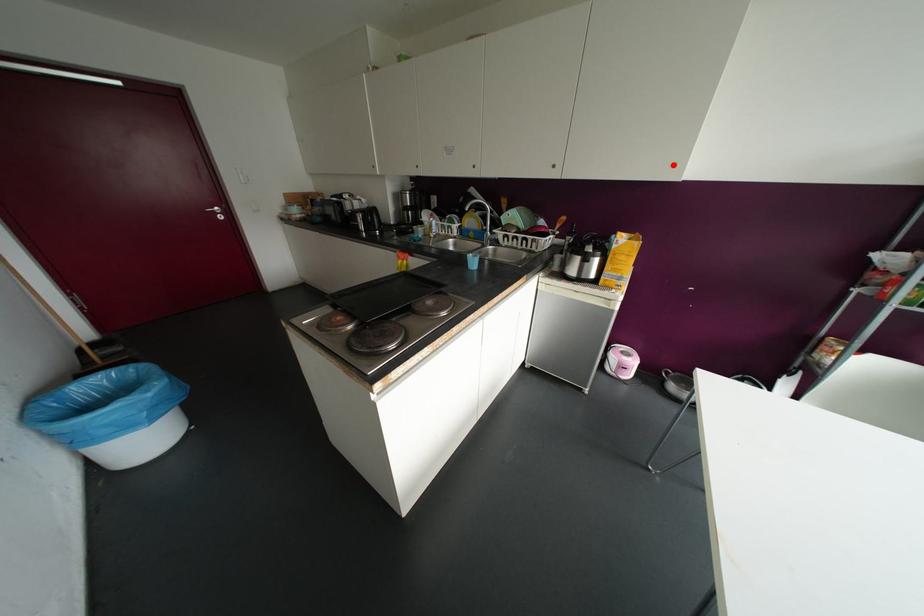
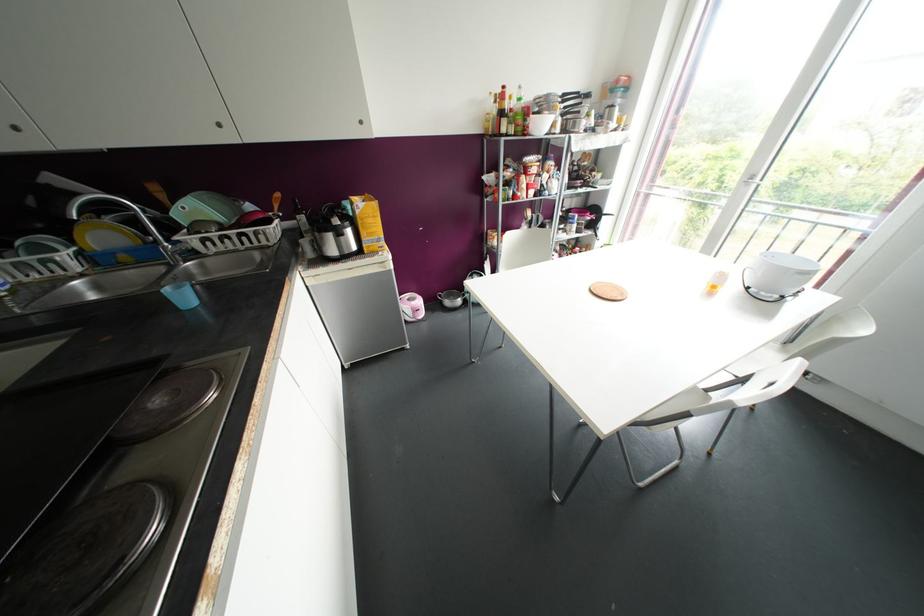
Question: I am providing you with two images of the same scene from different viewpoints. A red point is marked on the first image. At the location where the point appears in image 1, is it still visible in image 2?

Choices:
 (A) Yes
 (B) No

Answer: (A)